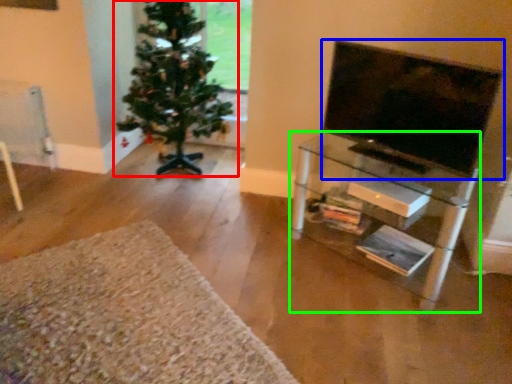
Question: Which object is positioned farthest from christmas tree (highlighted by a red box)? Select from television (highlighted by a blue box) and shelf (highlighted by a green box).

Choices:
 (A) television
 (B) shelf

Answer: (A)